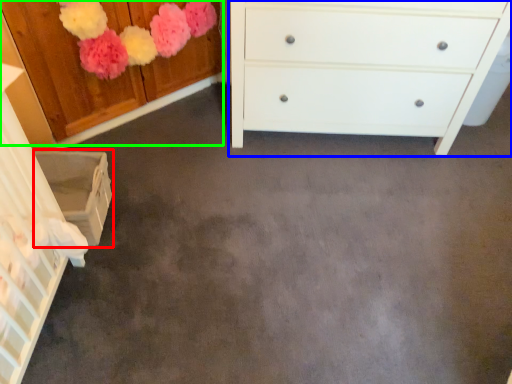
Question: Which is farther away from cabinetry (highlighted by a red box)? chest of drawers (highlighted by a blue box) or cabinetry (highlighted by a green box)?

Choices:
 (A) chest of drawers
 (B) cabinetry

Answer: (A)